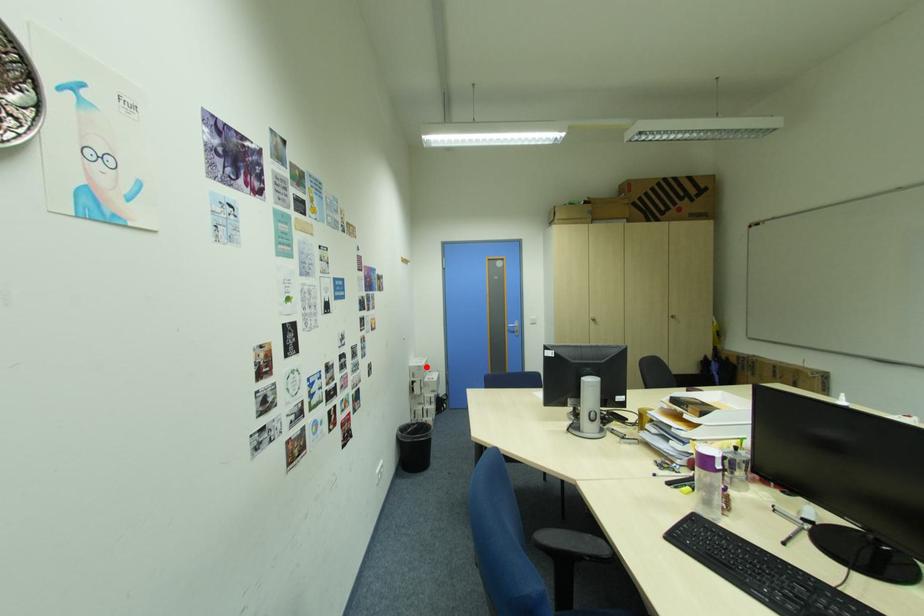
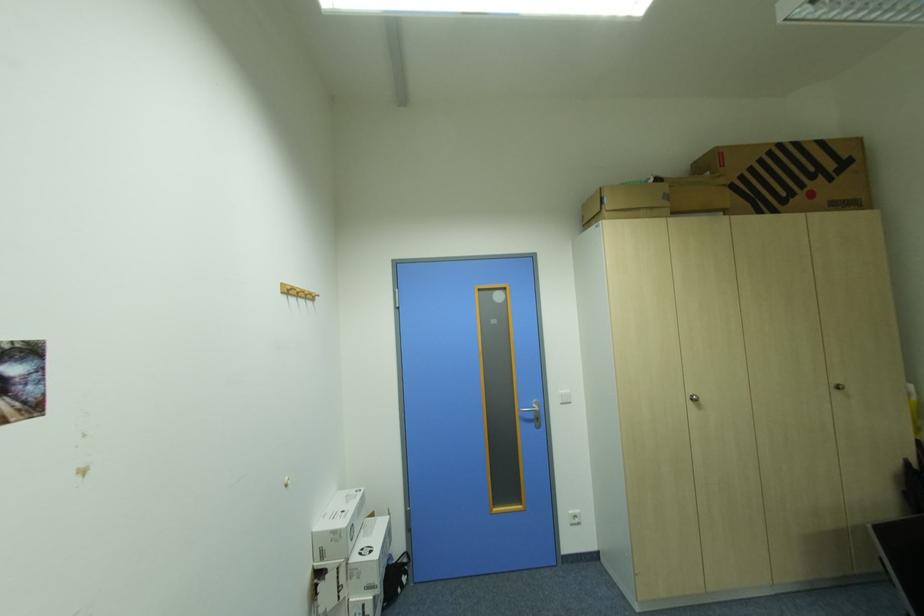
Where in the second image is the point corresponding to the highlighted location from the first image?

(341, 533)